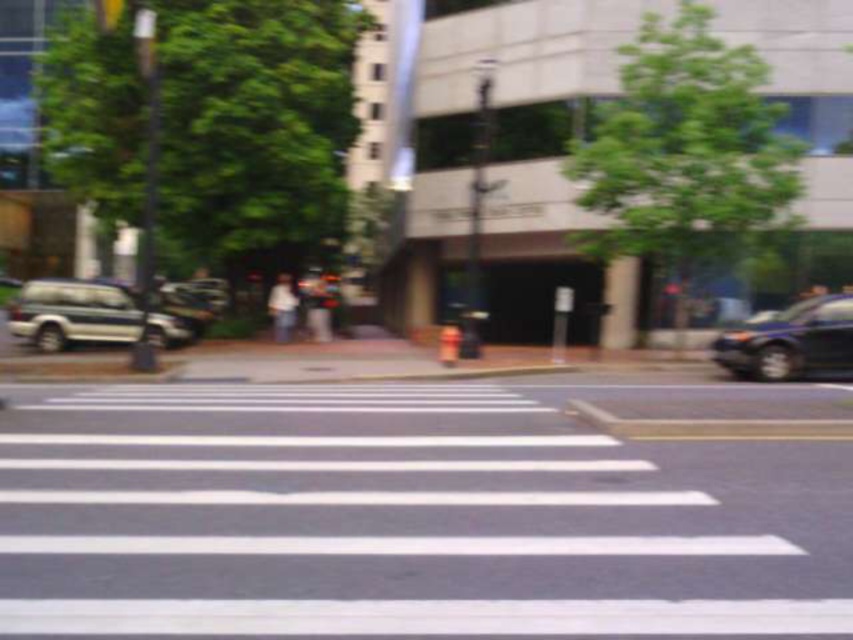
Measure the distance between white asphalt crosswalk at center and camera.

They are 5.01 meters apart.

Locate an element on the screen. The width and height of the screenshot is (853, 640). white asphalt crosswalk at center is located at coordinates (416, 515).

Is white asphalt crosswalk at center wider than metallic silver suv at left?

Yes, white asphalt crosswalk at center is wider than metallic silver suv at left.

Can you confirm if white asphalt crosswalk at center is taller than metallic silver suv at left?

No, white asphalt crosswalk at center is not taller than metallic silver suv at left.

Is point (431, 422) more distant than point (39, 307)?

No, (431, 422) is closer to viewer.

Identify the location of white asphalt crosswalk at center. The image size is (853, 640). (416, 515).

Measure the distance from metallic silver suv at left to shiny blue sedan at right.

metallic silver suv at left is 11.75 meters from shiny blue sedan at right.

Which is behind, point (109, 321) or point (769, 376)?

Point (109, 321)

Identify the location of metallic silver suv at left. This screenshot has height=640, width=853. (73, 314).